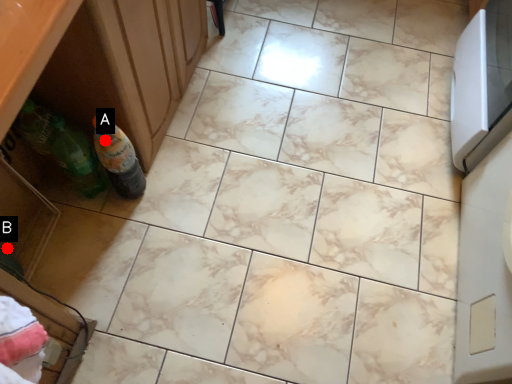
Question: Two points are circled on the image, labeled by A and B beside each circle. Which point is closer to the camera?

Choices:
 (A) A is closer
 (B) B is closer

Answer: (A)